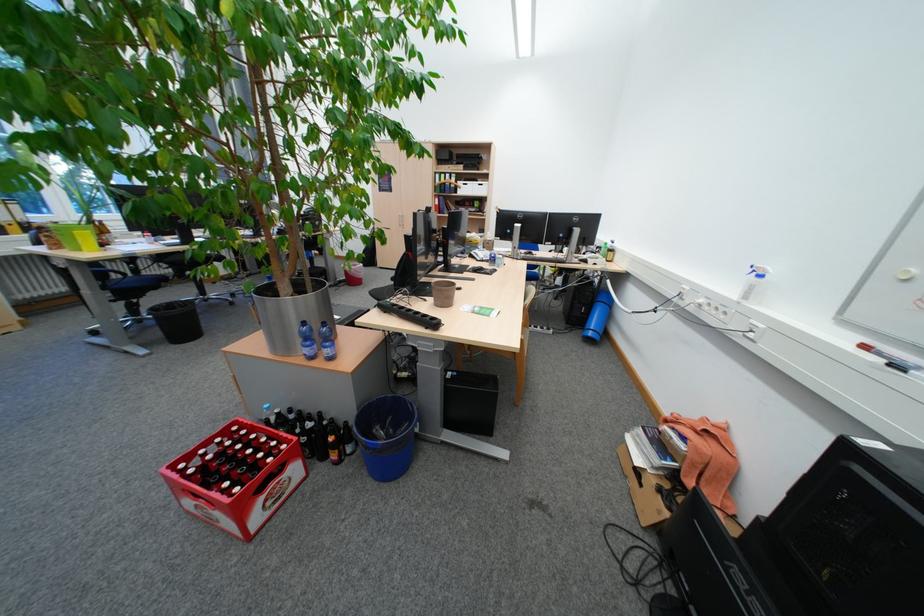
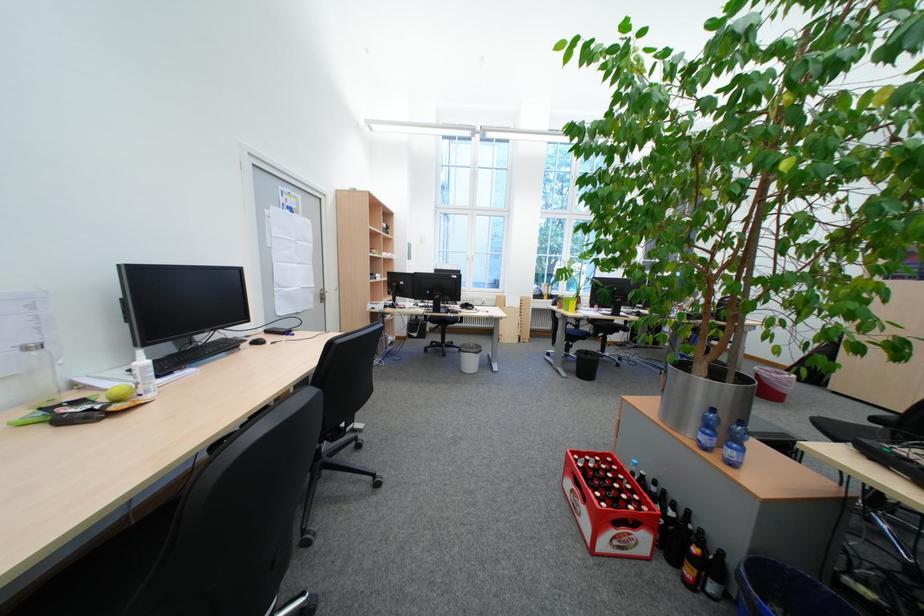
Where in the second image is the point corresponding to point (346, 456) from the first image?

(700, 573)